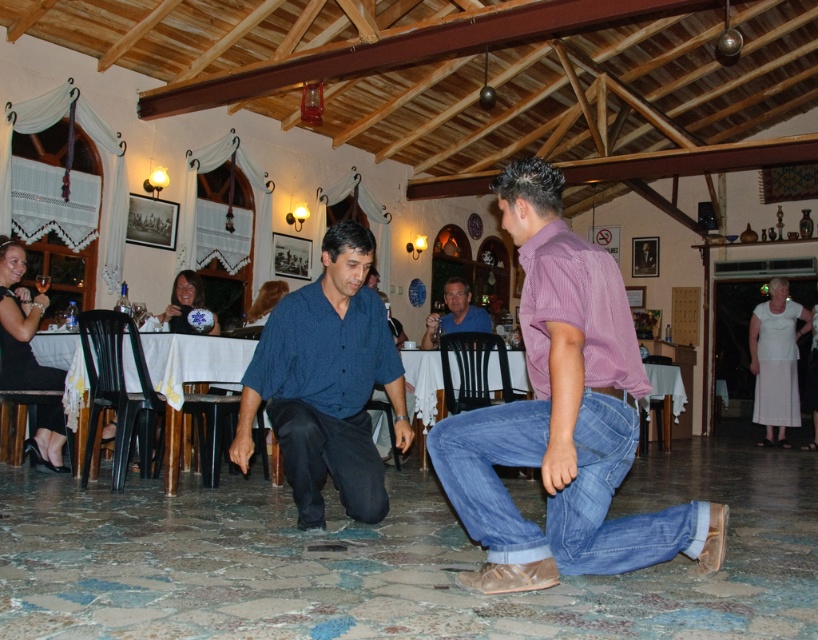
Does point (282, 324) come in front of point (481, 432)?

No, it is not.

Can you confirm if dark blue shirt at center is positioned to the right of blue denim jeans at lower center?

Incorrect, dark blue shirt at center is not on the right side of blue denim jeans at lower center.

Between point (360, 364) and point (673, 532), which one is positioned in front?

Point (673, 532)

In order to click on dark blue shirt at center in this screenshot , I will do `click(327, 384)`.

Who is positioned more to the right, dark blue shirt at center or blue shirt at center?

blue shirt at center

Which is behind, point (387, 356) or point (466, 321)?

The point (466, 321) is behind.

Which is in front, point (326, 392) or point (461, 310)?

Positioned in front is point (326, 392).

Locate an element on the screen. This screenshot has height=640, width=818. dark blue shirt at center is located at coordinates (327, 384).

Who is taller, pink striped shirt at center or dark blue denim jeans at center?

pink striped shirt at center

Does pink striped shirt at center come behind dark blue denim jeans at center?

No.

Image resolution: width=818 pixels, height=640 pixels. Identify the location of pink striped shirt at center. (562, 417).

Locate an element on the screen. The width and height of the screenshot is (818, 640). pink striped shirt at center is located at coordinates (562, 417).